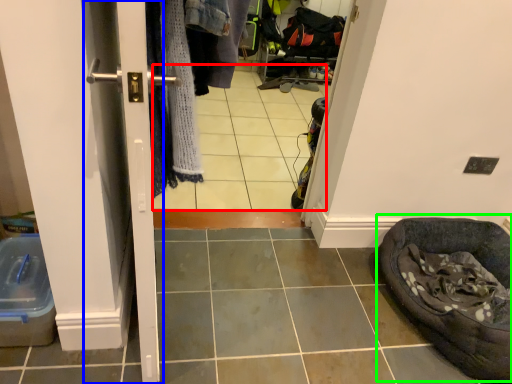
Question: Which is nearer to the tile (highlighted by a red box)? screen door (highlighted by a blue box) or bean bag chair (highlighted by a green box).

Choices:
 (A) screen door
 (B) bean bag chair

Answer: (B)